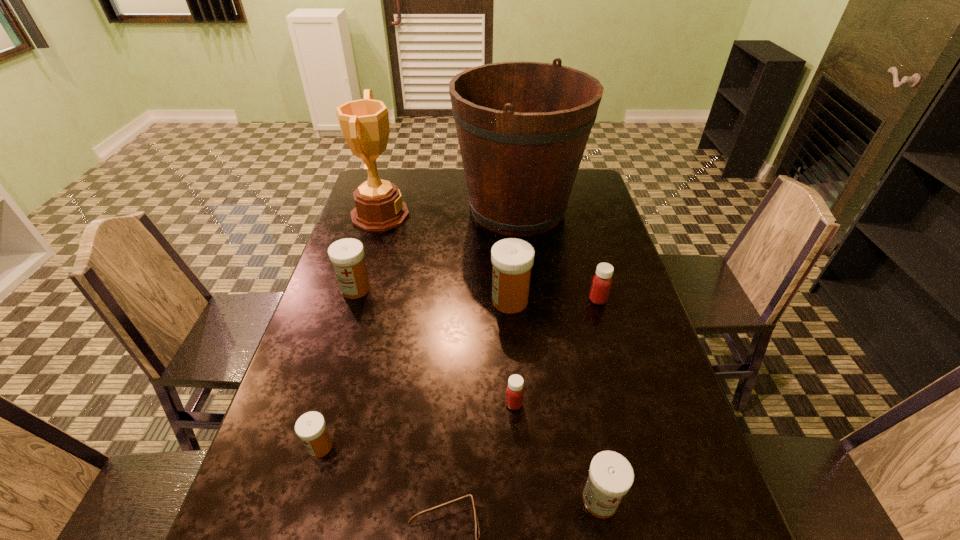
Find the location of a particular element. vacant region at the left edge is located at coordinates (324, 498).

I want to click on vacant space at the right edge of the desktop, so click(x=637, y=403).

The height and width of the screenshot is (540, 960). What are the coordinates of `free space that is in between the second white medicine from right to left and the award` in the screenshot? It's located at (445, 258).

You are a GUI agent. You are given a task and a screenshot of the screen. Output one action in this format:
    pyautogui.click(x=<x>, y=<y>)
    Task: Click on the free space between the award and the bucket
    The width and height of the screenshot is (960, 540).
    Given the screenshot: What is the action you would take?
    pyautogui.click(x=448, y=212)

The image size is (960, 540). I want to click on empty space between the farther red medicine and the award, so click(x=489, y=257).

This screenshot has height=540, width=960. Find the location of `empty location between the rightmost medicine and the nearer red medicine`. empty location between the rightmost medicine and the nearer red medicine is located at coordinates (556, 352).

I want to click on free space between the fifth shortest medicine and the third nearest object, so click(x=338, y=368).

Where is `the fifth closest object to the shortest object`? the fifth closest object to the shortest object is located at coordinates (347, 255).

The image size is (960, 540). I want to click on the fourth closest object to the bigger red medicine, so click(611, 475).

The width and height of the screenshot is (960, 540). What are the coordinates of `the fifth closest medicine to the sunglasses` in the screenshot? It's located at (347, 255).